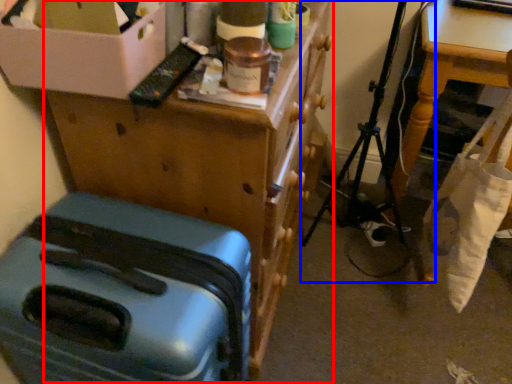
Question: Which of the following is the closest to the observer, furniture (highlighted by a red box) or folding chair (highlighted by a blue box)?

Choices:
 (A) furniture
 (B) folding chair

Answer: (A)